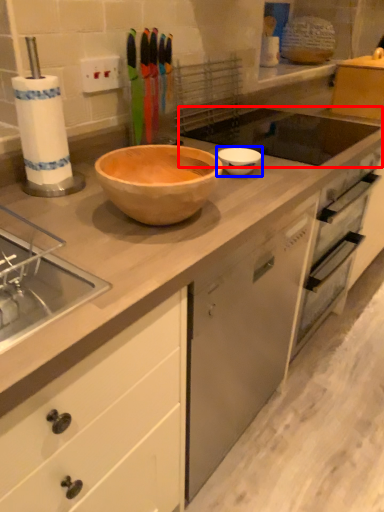
Question: Which point is closer to the camera, sink (highlighted by a red box) or basin (highlighted by a blue box)?

Choices:
 (A) sink
 (B) basin

Answer: (B)